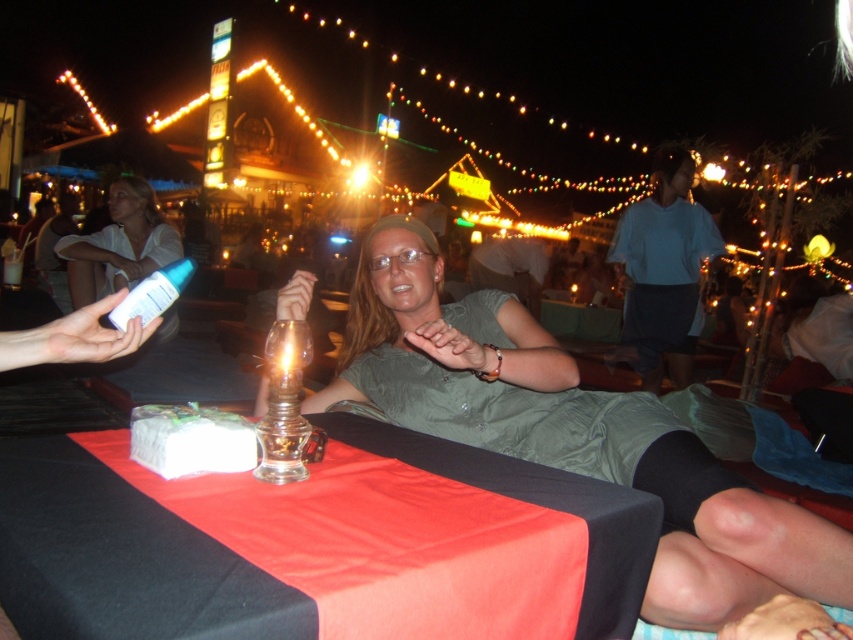
Who is lower down, matte green dress at center or light blue shirt at center?

matte green dress at center

At what (x,y) coordinates should I click in order to perform the action: click on matte green dress at center. Please return your answer as a coordinate pair (x, y). Looking at the image, I should click on (582, 442).

Who is more forward, (700, 326) or (111, 246)?

Point (111, 246)

Between light blue shirt at center and white matte bottle at left, which one appears on the right side from the viewer's perspective?

light blue shirt at center

Find the location of a particular element. This screenshot has width=853, height=640. light blue shirt at center is located at coordinates (663, 273).

You are a GUI agent. You are given a task and a screenshot of the screen. Output one action in this format:
    pyautogui.click(x=<x>, y=<y>)
    Task: Click on the light blue shirt at center
    Image resolution: width=853 pixels, height=640 pixels.
    Given the screenshot: What is the action you would take?
    pyautogui.click(x=663, y=273)

Does matte green dress at center come in front of black satin tablecloth at center?

No, it is not.

Does matte green dress at center appear on the right side of black satin tablecloth at center?

Indeed, matte green dress at center is positioned on the right side of black satin tablecloth at center.

Which is behind, point (770, 568) or point (207, 598)?

The point (770, 568) is more distant.

Image resolution: width=853 pixels, height=640 pixels. In order to click on matte green dress at center in this screenshot , I will do `click(582, 442)`.